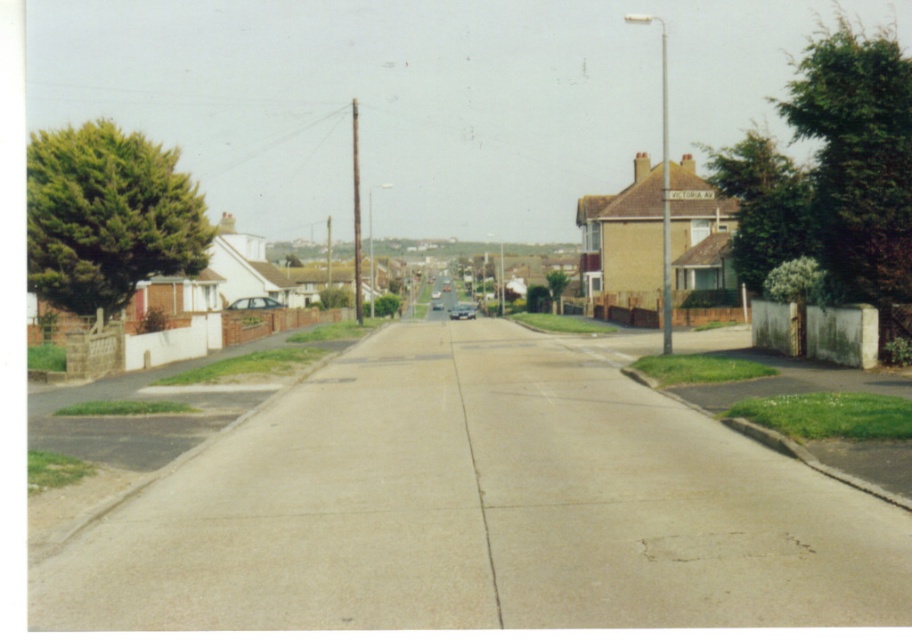
Can you confirm if matte silver car at center is positioned below shiny silver car at center?

No.

Measure the distance between matte silver car at center and shiny silver car at center.

matte silver car at center and shiny silver car at center are 72.91 feet apart from each other.

Measure the distance between matte silver car at center and camera.

matte silver car at center and camera are 61.81 meters apart.

The width and height of the screenshot is (912, 640). Find the location of `matte silver car at center`. matte silver car at center is located at coordinates point(254,304).